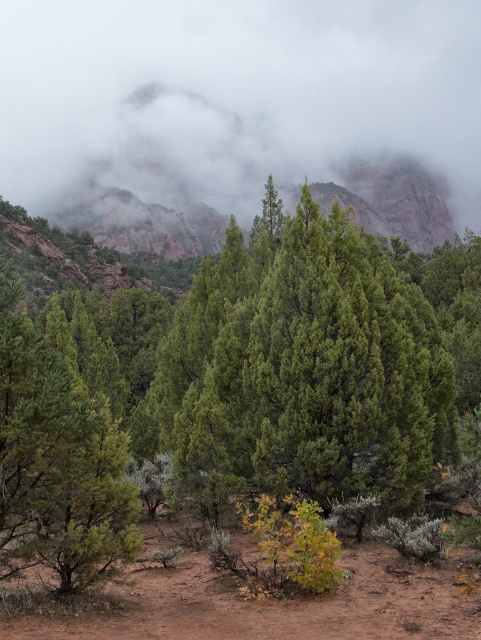
Question: Which of the following is the farthest from the observer?

Choices:
 (A) green needle-like trees at center
 (B) foggy misty cloud at upper center
 (C) green textured tree at left

Answer: (B)

Question: Does green needle-like trees at center appear under green textured tree at left?

Choices:
 (A) yes
 (B) no

Answer: (B)

Question: Does foggy misty cloud at upper center appear on the left side of green textured tree at left?

Choices:
 (A) yes
 (B) no

Answer: (B)

Question: Which point is farther to the camera?

Choices:
 (A) green needle-like trees at center
 (B) foggy misty cloud at upper center
 (C) green textured tree at left

Answer: (B)

Question: Which point is closer to the camera?

Choices:
 (A) green needle-like trees at center
 (B) green textured tree at left

Answer: (B)

Question: Does green needle-like trees at center have a lesser width compared to green textured tree at left?

Choices:
 (A) yes
 (B) no

Answer: (B)